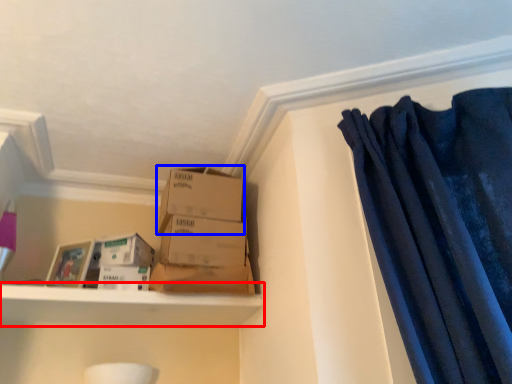
Question: Which object appears farthest to the camera in this image, shelf (highlighted by a red box) or box (highlighted by a blue box)?

Choices:
 (A) shelf
 (B) box

Answer: (B)